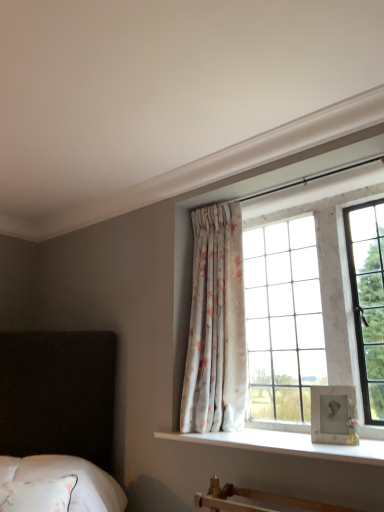
Question: From the image's perspective, does white soft bedding at lower left appear higher than floral fabric curtain at center?

Choices:
 (A) no
 (B) yes

Answer: (A)

Question: Is white soft bedding at lower left further to the viewer compared to floral fabric curtain at center?

Choices:
 (A) no
 (B) yes

Answer: (A)

Question: Is white soft bedding at lower left facing away from floral fabric curtain at center?

Choices:
 (A) no
 (B) yes

Answer: (A)

Question: Can you confirm if white soft bedding at lower left is smaller than floral fabric curtain at center?

Choices:
 (A) no
 (B) yes

Answer: (B)

Question: Is white soft bedding at lower left closer to camera compared to floral fabric curtain at center?

Choices:
 (A) yes
 (B) no

Answer: (A)

Question: Does point (372, 462) appear closer or farther from the camera than point (215, 376)?

Choices:
 (A) farther
 (B) closer

Answer: (B)

Question: In terms of height, does white smooth window sill at center look taller or shorter compared to floral fabric curtain at center?

Choices:
 (A) tall
 (B) short

Answer: (B)

Question: From the image's perspective, is white smooth window sill at center positioned above or below floral fabric curtain at center?

Choices:
 (A) above
 (B) below

Answer: (B)

Question: In the image, is white smooth window sill at center on the left side or the right side of floral fabric curtain at center?

Choices:
 (A) left
 (B) right

Answer: (B)

Question: In the image, is white textured glass at upper right positioned in front of or behind floral fabric curtain at center?

Choices:
 (A) front
 (B) behind

Answer: (A)

Question: Is white textured glass at upper right spatially inside floral fabric curtain at center, or outside of it?

Choices:
 (A) inside
 (B) outside

Answer: (B)

Question: Based on their positions, is white textured glass at upper right located to the left or right of floral fabric curtain at center?

Choices:
 (A) left
 (B) right

Answer: (B)

Question: In terms of width, does white textured glass at upper right look wider or thinner when compared to floral fabric curtain at center?

Choices:
 (A) wide
 (B) thin

Answer: (B)

Question: Does point [x=67, y=456] appear closer or farther from the camera than point [x=231, y=267]?

Choices:
 (A) closer
 (B) farther

Answer: (A)

Question: Is white soft bedding at lower left taller or shorter than floral fabric curtain at center?

Choices:
 (A) tall
 (B) short

Answer: (B)